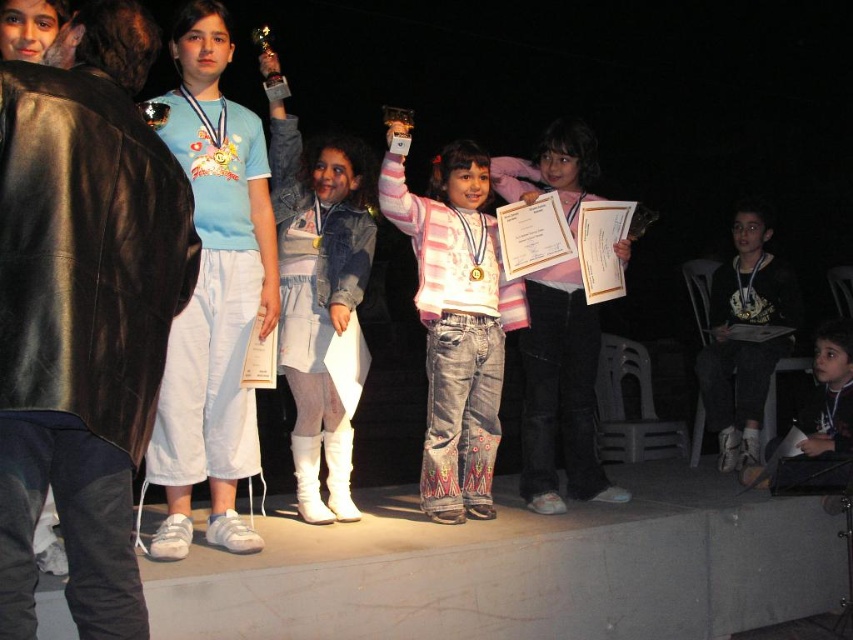
What do you see at coordinates (318, 298) in the screenshot? I see `white leather boots at center` at bounding box center [318, 298].

Is white leather boots at center bigger than pink striped sweater at center?

No.

Is point (315, 515) closer to viewer compared to point (444, 435)?

Yes, point (315, 515) is closer to viewer.

Locate an element on the screen. This screenshot has width=853, height=640. white leather boots at center is located at coordinates (318, 298).

Is white leather boots at center closer to camera compared to black leather jacket at lower right?

Yes.

Is white leather boots at center to the left of black leather jacket at lower right from the viewer's perspective?

Yes, white leather boots at center is to the left of black leather jacket at lower right.

What are the coordinates of `white leather boots at center` in the screenshot? It's located at (318, 298).

Between point (466, 342) and point (751, 406), which one is positioned behind?

Point (751, 406)

Is pink striped sweater at center thinner than black leather jacket at lower right?

In fact, pink striped sweater at center might be wider than black leather jacket at lower right.

Does point (457, 172) come in front of point (786, 314)?

Yes, it is.

At what (x,y) coordinates should I click in order to perform the action: click on pink striped sweater at center. Please return your answer as a coordinate pair (x, y). This screenshot has height=640, width=853. Looking at the image, I should click on (456, 324).